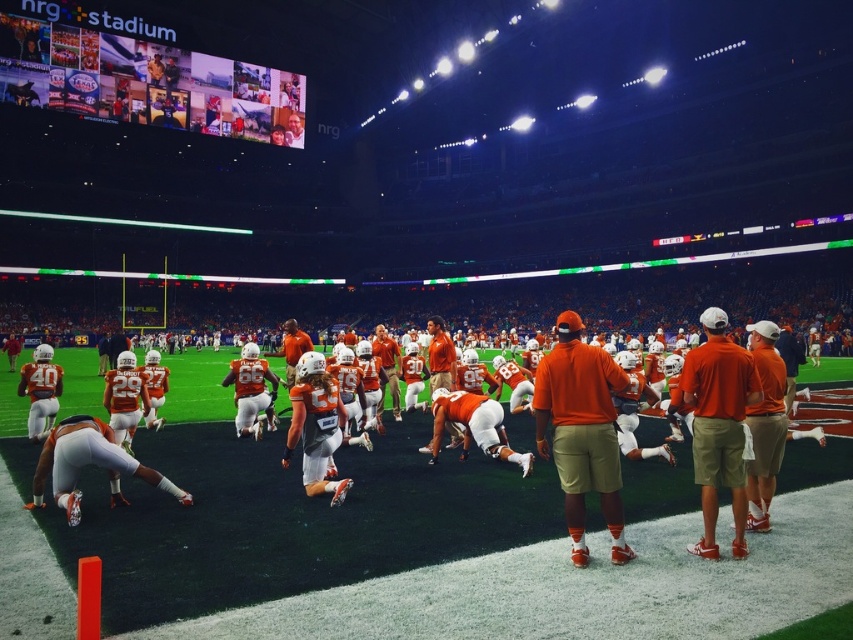
You are a photographer at NRG Stadium and want to take a picture of both the orange matte uniform at center and the orange cotton shirt at center. Which uniform will appear larger in the photo?

The orange matte uniform at center will appear larger in the photo because it is closer to the viewer than the orange cotton shirt at center.

You are a photographer standing at the center of the field at NRG Stadium. You want to take a photo of the orange cotton shirt at center. Where should you aim your camera to capture it?

The orange cotton shirt at center is located at point coordinates (x=581, y=432), so aim your camera towards that position to capture it.